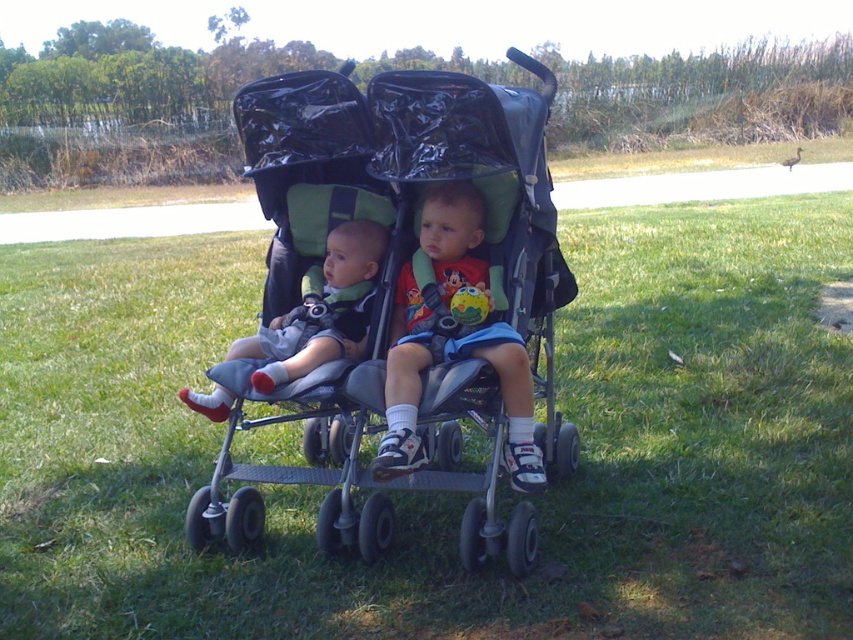
You are a delivery drone flying over a grassy area. You need to land at a specific point to deliver a package. The coordinates for the landing point are given as point (399, 296). Can you confirm if there is a suitable landing spot at that point?

Yes, there is a suitable landing spot at point (399, 296) because it is the location of the black plastic stroller at center, which indicates an open grassy area.

Looking at this image, you are a parent trying to decide where to place a small toy for both children in the double stroller to reach easily. The toy must be placed on either the green grass at center or the matte green cushion at center. Which surface should you choose to ensure the toy is within reach of both children?

The matte green cushion at center occupies more space than the green grass at center, so placing the toy on the matte green cushion at center would provide a larger area for both children to reach it.

You are a delivery person who needs to place a small package between the black plastic stroller at center and the matte green cushion at center. The package is 8 inches long. Can you fit it between them without moving the stroller or cushion?

The black plastic stroller at center and matte green cushion at center are 7.53 inches apart from each other, so the 8 inch package cannot fit between them as the space is smaller than the package length.